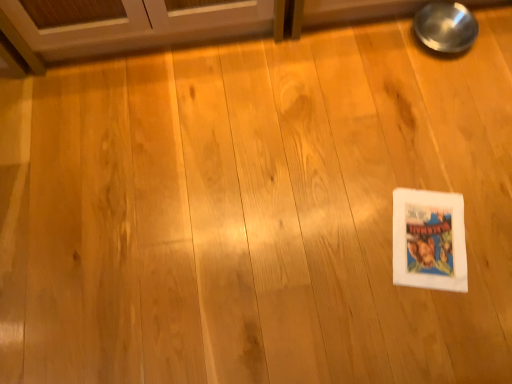
Locate an element on the screen. This screenshot has height=384, width=512. blank space situated above white paper comic book at lower right (from a real-world perspective) is located at coordinates (426, 237).